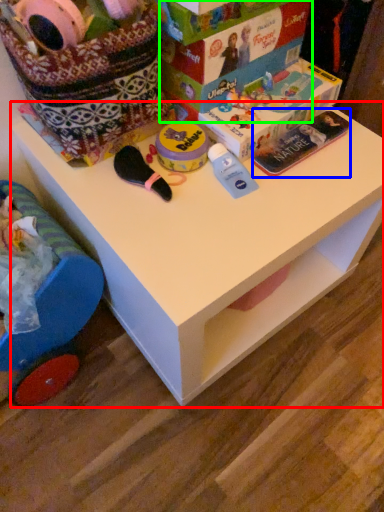
Question: Which is nearer to the table (highlighted by a red box)? magazine (highlighted by a blue box) or storage box (highlighted by a green box).

Choices:
 (A) magazine
 (B) storage box

Answer: (A)